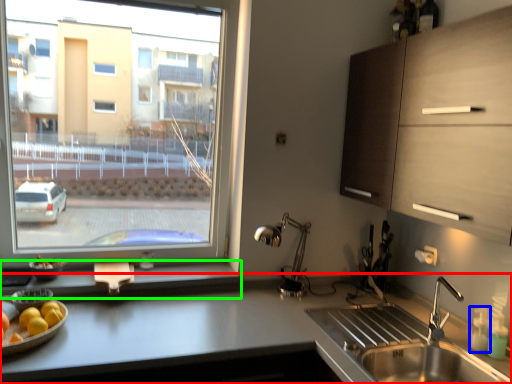
Question: Considering the real-world distances, which object is closest to countertop (highlighted by a red box)? bottle (highlighted by a blue box) or window sill (highlighted by a green box).

Choices:
 (A) bottle
 (B) window sill

Answer: (B)